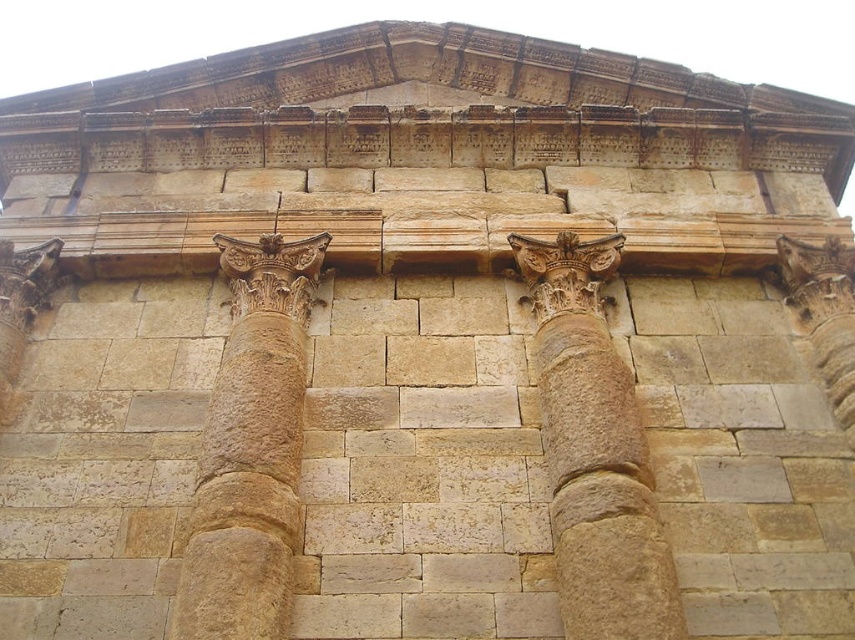
You are standing in front of the ancient stone facade and want to take a photo of the point at coordinates point (543, 349). Your camera has a maximum focus range of 150 feet. Will the camera be able to focus on the point?

The distance of point (543, 349) from the camera is 163.79 feet, which exceeds the camera maximum focus range of 150 feet. Therefore, the camera will not be able to focus on the point.

In the scene shown: You are an architect examining the ancient structure. You notice the beige stone column at center and the brown stone column at center. Which column is located directly above the other?

The beige stone column at center is positioned under the brown stone column at center, meaning the brown stone column at center is directly above the beige stone column at center.

You are an architect examining the ancient structure. You notice the beige stone column at center and the brown stone column at center. Which column is shorter?

The beige stone column at center is shorter than the brown stone column at center.